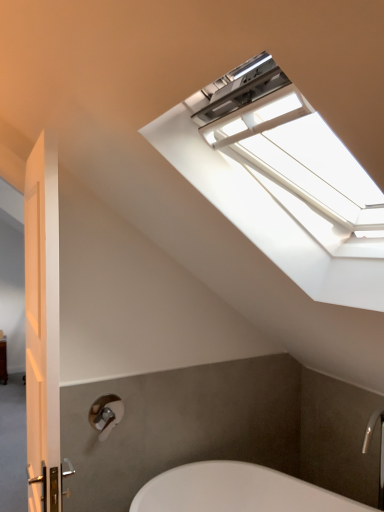
This screenshot has width=384, height=512. What do you see at coordinates (106, 414) in the screenshot? I see `matte silver shower at lower left` at bounding box center [106, 414].

The image size is (384, 512). Find the location of `white glossy door at left`. white glossy door at left is located at coordinates (x=43, y=326).

How many degrees apart are the facing directions of white glossy door at left and white plastic window at upper center?

They differ by 4.24 degrees in their facing directions.

From the image's perspective, is white glossy door at left below white plastic window at upper center?

Yes, from the image's perspective, white glossy door at left is below white plastic window at upper center.

Is white glossy door at left oriented towards white plastic window at upper center?

No, white glossy door at left is not aimed at white plastic window at upper center.

Locate an element on the screen. The width and height of the screenshot is (384, 512). window that is above the white glossy door at left (from a real-world perspective) is located at coordinates (281, 180).

Is silver metallic faucet at lower right taller or shorter than matte silver shower at lower left?

In the image, silver metallic faucet at lower right appears to be taller than matte silver shower at lower left.

In the scene shown: Is silver metallic faucet at lower right positioned with its back to matte silver shower at lower left?

No, silver metallic faucet at lower right is not facing the opposite direction of matte silver shower at lower left.

Looking at the image, does silver metallic faucet at lower right seem bigger or smaller compared to matte silver shower at lower left?

Clearly, silver metallic faucet at lower right is larger in size than matte silver shower at lower left.

Which is behind, point (382, 417) or point (101, 411)?

The point (382, 417) is farther from the camera.

Measure the distance from matte silver shower at lower left to white glossy door at left.

They are 72.93 centimeters apart.

Considering the relative sizes of matte silver shower at lower left and white glossy door at left in the image provided, is matte silver shower at lower left wider than white glossy door at left?

Yes.

Is the surface of matte silver shower at lower left in direct contact with white glossy door at left?

Result: They are not placed beside each other.

From a real-world perspective, between matte silver shower at lower left and white glossy door at left, who is vertically higher?

In real-world perspective, white glossy door at left is above.

How distant is white plastic window at upper center from matte silver shower at lower left?

white plastic window at upper center is 1.28 meters away from matte silver shower at lower left.

You are a GUI agent. You are given a task and a screenshot of the screen. Output one action in this format:
    pyautogui.click(x=<x>, y=<y>)
    Task: Click on the shower below the white plastic window at upper center (from a real-world perspective)
    
    Given the screenshot: What is the action you would take?
    pyautogui.click(x=106, y=414)

Is white plastic window at upper center positioned far away from matte silver shower at lower left?

Yes, white plastic window at upper center and matte silver shower at lower left are quite far apart.

Is white plastic window at upper center spatially inside matte silver shower at lower left, or outside of it?

white plastic window at upper center is not inside matte silver shower at lower left, it's outside.

Based on the photo, can you tell me how much matte silver shower at lower left and white plastic window at upper center differ in facing direction?

86.7 degrees separate the facing orientations of matte silver shower at lower left and white plastic window at upper center.

Does point (113, 407) come in front of point (286, 129)?

That is False.

From a real-world perspective, is matte silver shower at lower left on top of white plastic window at upper center?

No, from a real-world perspective, matte silver shower at lower left is not over white plastic window at upper center

Is matte silver shower at lower left facing away from white plastic window at upper center?

That's not correct — matte silver shower at lower left is not looking away from white plastic window at upper center.

Between white glossy door at left and silver metallic faucet at lower right, which one has less height?

Standing shorter between the two is silver metallic faucet at lower right.

Can you confirm if white glossy door at left is thinner than silver metallic faucet at lower right?

Yes, white glossy door at left is thinner than silver metallic faucet at lower right.

From the image's perspective, is white glossy door at left below silver metallic faucet at lower right?

Incorrect, from the image's perspective, white glossy door at left is higher than silver metallic faucet at lower right.

Which is in front, point (39, 165) or point (363, 443)?

Point (39, 165)

How far apart are matte silver shower at lower left and silver metallic faucet at lower right?

matte silver shower at lower left and silver metallic faucet at lower right are 1.22 meters apart.

Is matte silver shower at lower left facing away from silver metallic faucet at lower right?

matte silver shower at lower left is not turned away from silver metallic faucet at lower right.

This screenshot has width=384, height=512. In order to click on faucet on the right side of matte silver shower at lower left in this screenshot , I will do `click(380, 445)`.

Considering the sizes of objects matte silver shower at lower left and silver metallic faucet at lower right in the image provided, who is thinner, matte silver shower at lower left or silver metallic faucet at lower right?

matte silver shower at lower left is thinner.

The image size is (384, 512). I want to click on window in front of the white glossy door at left, so click(x=281, y=180).

Where is `shower that appears behind the silver metallic faucet at lower right`? The width and height of the screenshot is (384, 512). shower that appears behind the silver metallic faucet at lower right is located at coordinates pyautogui.click(x=106, y=414).

When comparing their distances from white glossy door at left, does matte silver shower at lower left or silver metallic faucet at lower right seem further?

silver metallic faucet at lower right lies further to white glossy door at left than the other object.

Considering their positions, is white glossy door at left positioned closer to silver metallic faucet at lower right than matte silver shower at lower left?

matte silver shower at lower left is positioned closer to the anchor silver metallic faucet at lower right.

Based on their spatial positions, is silver metallic faucet at lower right or matte silver shower at lower left further from white glossy door at left?

silver metallic faucet at lower right is further to white glossy door at left.

Consider the image. From the image, which object appears to be nearer to matte silver shower at lower left, white plastic window at upper center or silver metallic faucet at lower right?

silver metallic faucet at lower right is positioned closer to the anchor matte silver shower at lower left.

Based on their spatial positions, is white plastic window at upper center or white glossy door at left closer to matte silver shower at lower left?

Among the two, white glossy door at left is located nearer to matte silver shower at lower left.

Considering their positions, is matte silver shower at lower left positioned further to silver metallic faucet at lower right than white plastic window at upper center?

The object further to silver metallic faucet at lower right is white plastic window at upper center.

From the picture: From the image, which object appears to be nearer to matte silver shower at lower left, silver metallic faucet at lower right or white glossy door at left?

The object closer to matte silver shower at lower left is white glossy door at left.

Considering their positions, is white plastic window at upper center positioned closer to white glossy door at left than silver metallic faucet at lower right?

Based on the image, white plastic window at upper center appears to be nearer to white glossy door at left.

Image resolution: width=384 pixels, height=512 pixels. I want to click on window located between white glossy door at left and silver metallic faucet at lower right in the left-right direction, so click(281, 180).

You are a GUI agent. You are given a task and a screenshot of the screen. Output one action in this format:
    pyautogui.click(x=<x>, y=<y>)
    Task: Click on the faucet between white plastic window at upper center and matte silver shower at lower left along the z-axis
    
    Given the screenshot: What is the action you would take?
    pyautogui.click(x=380, y=445)

This screenshot has height=512, width=384. Identify the location of shower situated between white glossy door at left and silver metallic faucet at lower right from left to right. (106, 414).

Find the location of `door located between white plastic window at upper center and matte silver shower at lower left in the depth direction`. door located between white plastic window at upper center and matte silver shower at lower left in the depth direction is located at coordinates (43, 326).